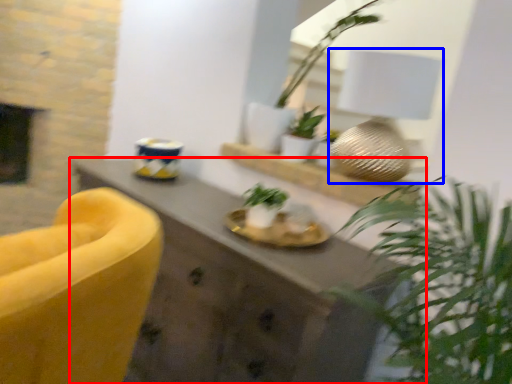
Question: Which object is closer to the camera taking this photo, desk (highlighted by a red box) or table lamp (highlighted by a blue box)?

Choices:
 (A) desk
 (B) table lamp

Answer: (A)